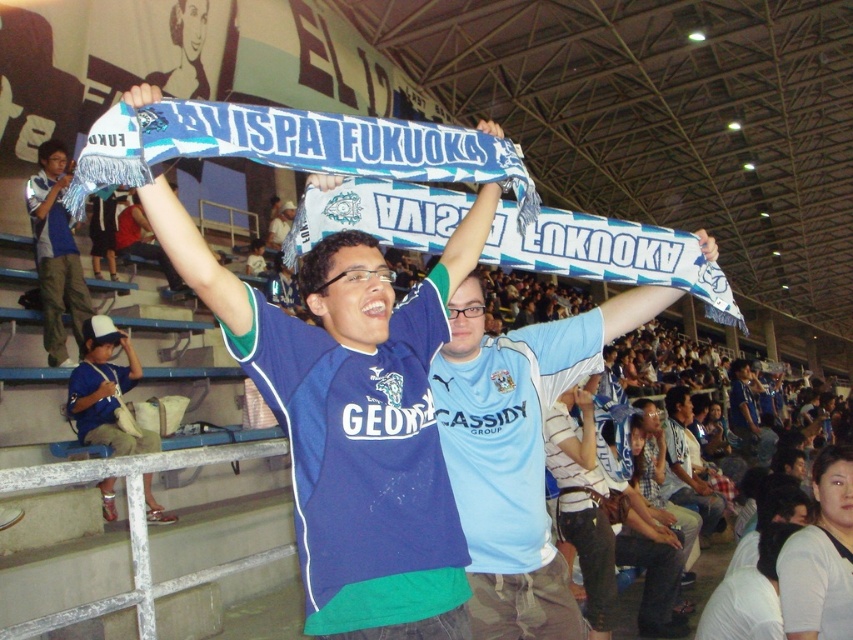
Question: Is matte blue shirt at lower left smaller than matte blue scarf at left?

Choices:
 (A) yes
 (B) no

Answer: (A)

Question: Which object is the closest to the blue jersey at center?

Choices:
 (A) matte blue shirt at lower left
 (B) matte blue scarf at center

Answer: (A)

Question: Does matte blue scarf at left have a smaller size compared to blue jersey at center?

Choices:
 (A) no
 (B) yes

Answer: (B)

Question: Does matte blue shirt at lower left lie behind matte blue scarf at left?

Choices:
 (A) yes
 (B) no

Answer: (B)

Question: Which of the following is the farthest from the observer?

Choices:
 (A) (413, 372)
 (B) (757, 452)

Answer: (B)

Question: Which point is farther to the camera?

Choices:
 (A) (766, 429)
 (B) (125, 410)
 (C) (376, 621)
 (D) (50, 316)

Answer: (A)